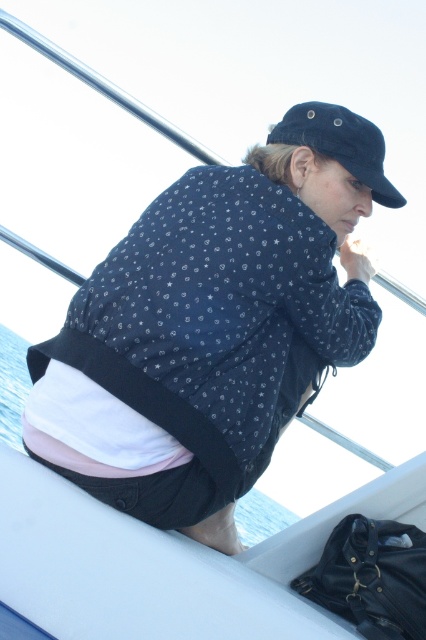
You are standing on the deck of a boat and want to reach a point marked at coordinates point [285,259]. If your arm can extend 5 feet, can you reach it without moving?

The distance of point [285,259] from camera is 6.23 feet, so no, you cannot reach it with a 5 feet arm extension since it is farther away.

You are a photographer trying to capture a shot of the person in the matte black jacket at center and the blue water at lower left. Which object will appear larger in your photo?

The matte black jacket at center will appear larger in the photo because it is closer to the viewer than the blue water at lower left.

You are standing on the dock and see the black matte baseball cap at upper center. If you want to reach it without moving from your current position, can you do so?

The black matte baseball cap at upper center is 7.03 feet away from you, so you cannot reach it without moving closer.